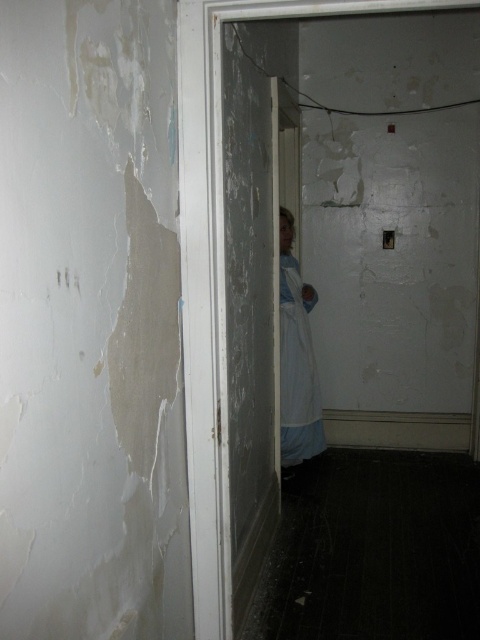
Question: Is white matte door at center behind white fabric dress at center?

Choices:
 (A) no
 (B) yes

Answer: (A)

Question: Among these points, which one is farthest from the camera?

Choices:
 (A) (282, 241)
 (B) (452, 0)

Answer: (A)

Question: Where is white matte door at center located in relation to white fabric dress at center in the image?

Choices:
 (A) right
 (B) left

Answer: (B)

Question: Among these points, which one is nearest to the camera?

Choices:
 (A) (300, 358)
 (B) (183, 33)

Answer: (B)

Question: Can you confirm if white matte door at center is positioned above white fabric dress at center?

Choices:
 (A) no
 (B) yes

Answer: (B)